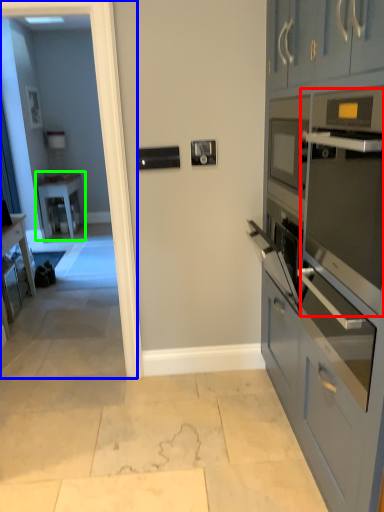
Question: Based on their relative distances, which object is nearer to oven (highlighted by a red box)? Choose from glass door (highlighted by a blue box) and table (highlighted by a green box).

Choices:
 (A) glass door
 (B) table

Answer: (A)